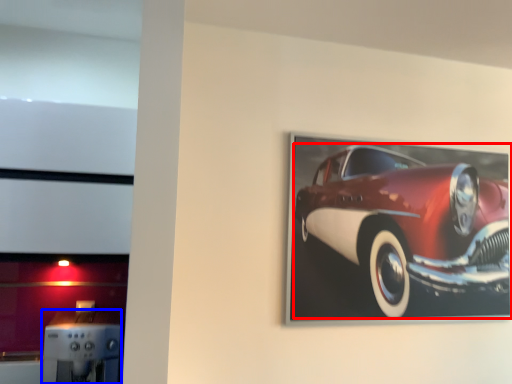
Question: Which object is closer to the camera taking this photo, car (highlighted by a red box) or appliance (highlighted by a blue box)?

Choices:
 (A) car
 (B) appliance

Answer: (B)